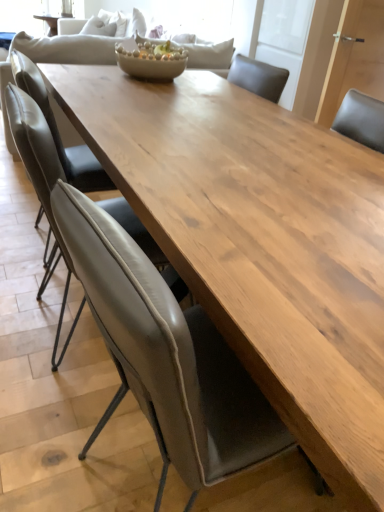
Question: From a real-world perspective, is leather at center, which is counted as the third chair, starting from the back, under matte ceramic bowl at center?

Choices:
 (A) no
 (B) yes

Answer: (B)

Question: Is leather at center, which is counted as the third chair, starting from the back, turned away from matte ceramic bowl at center?

Choices:
 (A) no
 (B) yes

Answer: (A)

Question: Does leather at center, which is counted as the third chair, starting from the back, have a larger size compared to matte ceramic bowl at center?

Choices:
 (A) yes
 (B) no

Answer: (A)

Question: Can you confirm if leather at center, which is the 1th chair from front to back, is wider than matte ceramic bowl at center?

Choices:
 (A) yes
 (B) no

Answer: (A)

Question: Is leather at center, which is counted as the third chair, starting from the back, smaller than matte ceramic bowl at center?

Choices:
 (A) no
 (B) yes

Answer: (A)

Question: Is leather at center, which is counted as the third chair, starting from the back, outside matte ceramic bowl at center?

Choices:
 (A) yes
 (B) no

Answer: (A)

Question: Considering the relative sizes of matte ceramic bowl at center and leather at left, arranged as the first chair when viewed from the back, in the image provided, is matte ceramic bowl at center shorter than leather at left, arranged as the first chair when viewed from the back,?

Choices:
 (A) yes
 (B) no

Answer: (A)

Question: Does matte ceramic bowl at center have a larger size compared to leather at left, the third chair positioned from the front?

Choices:
 (A) no
 (B) yes

Answer: (A)

Question: Can you confirm if matte ceramic bowl at center is thinner than leather at left, the third chair positioned from the front?

Choices:
 (A) yes
 (B) no

Answer: (A)

Question: From a real-world perspective, does matte ceramic bowl at center stand above leather at left, the third chair positioned from the front?

Choices:
 (A) no
 (B) yes

Answer: (B)

Question: From a real-world perspective, is matte ceramic bowl at center under leather at left, the third chair positioned from the front?

Choices:
 (A) yes
 (B) no

Answer: (B)

Question: Is the position of matte ceramic bowl at center less distant than that of leather at left, arranged as the first chair when viewed from the back?

Choices:
 (A) yes
 (B) no

Answer: (B)

Question: Considering the relative sizes of leather at center, which is counted as the third chair, starting from the back, and matte gray chair at center, the second chair viewed from the back, in the image provided, is leather at center, which is counted as the third chair, starting from the back, thinner than matte gray chair at center, the second chair viewed from the back,?

Choices:
 (A) yes
 (B) no

Answer: (B)